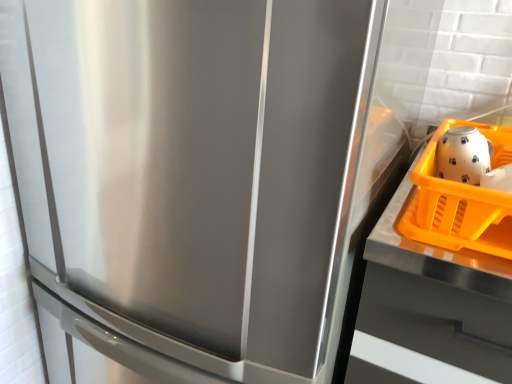
Question: Considering the relative sizes of white glossy tea pot at upper right and orange plastic basket at right in the image provided, is white glossy tea pot at upper right shorter than orange plastic basket at right?

Choices:
 (A) yes
 (B) no

Answer: (A)

Question: Considering the relative sizes of white glossy tea pot at upper right and orange plastic basket at right in the image provided, is white glossy tea pot at upper right taller than orange plastic basket at right?

Choices:
 (A) yes
 (B) no

Answer: (B)

Question: Is white glossy tea pot at upper right placed right next to orange plastic basket at right?

Choices:
 (A) no
 (B) yes

Answer: (B)

Question: Is white glossy tea pot at upper right at the left side of orange plastic basket at right?

Choices:
 (A) yes
 (B) no

Answer: (A)

Question: Can you confirm if white glossy tea pot at upper right is thinner than orange plastic basket at right?

Choices:
 (A) yes
 (B) no

Answer: (A)

Question: From a real-world perspective, is white glossy tea pot at upper right beneath orange plastic basket at right?

Choices:
 (A) no
 (B) yes

Answer: (A)

Question: Can we say orange plastic basket at right lies outside white glossy tea pot at upper right?

Choices:
 (A) no
 (B) yes

Answer: (B)

Question: From a real-world perspective, does orange plastic basket at right sit lower than white glossy tea pot at upper right?

Choices:
 (A) yes
 (B) no

Answer: (A)

Question: From the image's perspective, would you say orange plastic basket at right is positioned over white glossy tea pot at upper right?

Choices:
 (A) no
 (B) yes

Answer: (A)

Question: Can you confirm if orange plastic basket at right is taller than white glossy tea pot at upper right?

Choices:
 (A) no
 (B) yes

Answer: (B)

Question: Considering the relative positions of orange plastic basket at right and white glossy tea pot at upper right in the image provided, is orange plastic basket at right in front of white glossy tea pot at upper right?

Choices:
 (A) yes
 (B) no

Answer: (A)

Question: Is orange plastic basket at right smaller than white glossy tea pot at upper right?

Choices:
 (A) yes
 (B) no

Answer: (B)

Question: Is orange plastic tray at right directly adjacent to orange plastic basket at right?

Choices:
 (A) yes
 (B) no

Answer: (A)